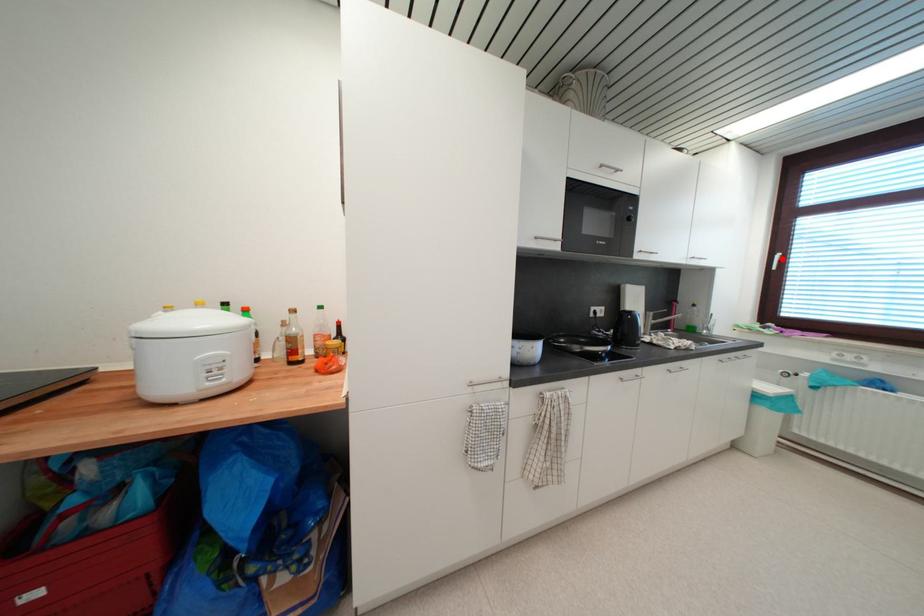
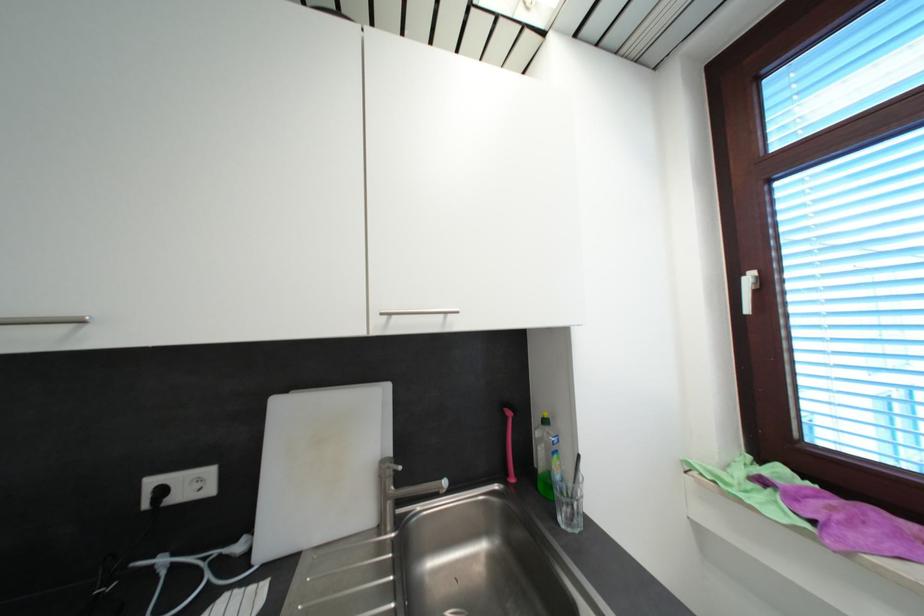
Find the pixel in the second image that matches the highlighted location in the first image.

(754, 281)